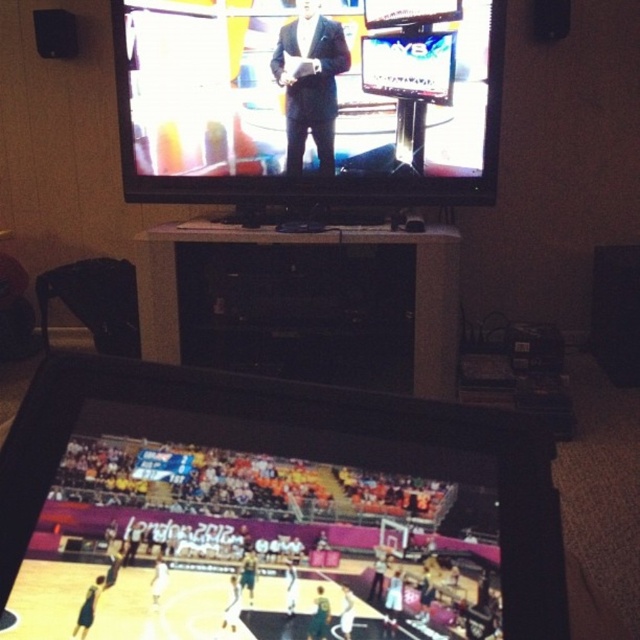
You are a delivery person who needs to place a new 17 inch wide package between the black glossy tv at upper center and the black glossy entertainment center at center. Can you fit the package in the space between them?

The space between the black glossy tv at upper center and the black glossy entertainment center at center is 17.71 inches. Since the package is 17 inches wide, it can fit in the space between them as it is slightly narrower than the available space.

Based on the photo, you are a guest at a party and want to talk to the person wearing the matte black suit at center without blocking the view of the black glossy entertainment center at center. Which side should you stand on relative to the entertainment center?

You should stand to the right of the black glossy entertainment center at center because the matte black suit at center is to the right of it, so standing there allows you to talk to them without blocking the entertainment center.